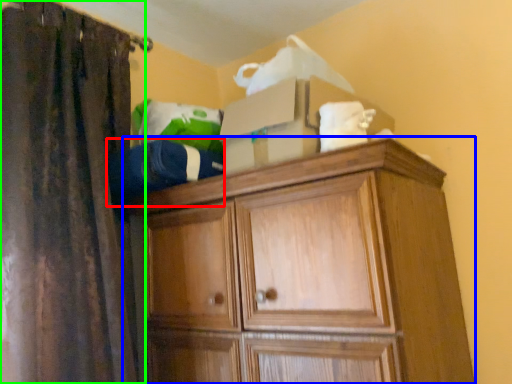
Question: Which object is the farthest from clothing (highlighted by a red box)? Choose among these: cupboard (highlighted by a blue box) or curtain (highlighted by a green box).

Choices:
 (A) cupboard
 (B) curtain

Answer: (A)